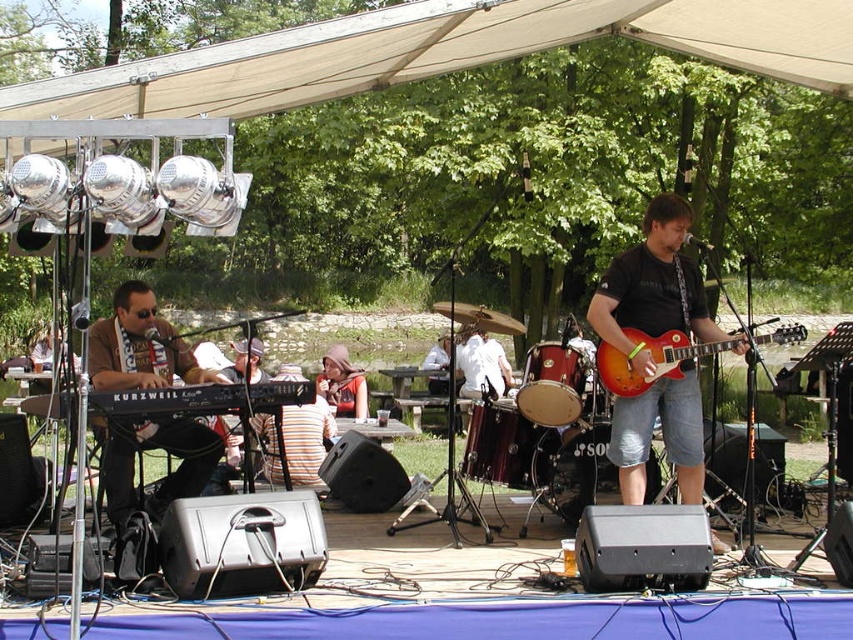
Does satin red guitar at center have a lesser height compared to wooden drum at center?

Incorrect, satin red guitar at center's height does not fall short of wooden drum at center's.

I want to click on satin red guitar at center, so click(x=654, y=289).

What do you see at coordinates (654, 289) in the screenshot?
I see `satin red guitar at center` at bounding box center [654, 289].

I want to click on satin red guitar at center, so click(x=654, y=289).

Between black matte keyboard at center and glossy wood guitar at center right, which one has less height?

glossy wood guitar at center right

Based on the photo, does black matte keyboard at center appear on the left side of glossy wood guitar at center right?

Indeed, black matte keyboard at center is positioned on the left side of glossy wood guitar at center right.

Where is `black matte keyboard at center`? Image resolution: width=853 pixels, height=640 pixels. black matte keyboard at center is located at coordinates (138, 346).

Between point (619, 396) and point (223, 449), which one is positioned behind?

The point (223, 449) is more distant.

Between satin red guitar at center and black matte keyboard at center, which one is positioned lower?

black matte keyboard at center

The height and width of the screenshot is (640, 853). I want to click on satin red guitar at center, so click(x=654, y=289).